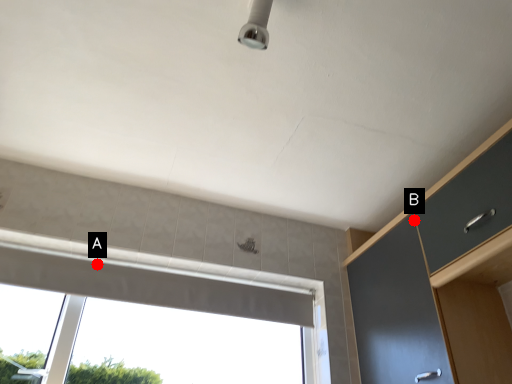
Question: Two points are circled on the image, labeled by A and B beside each circle. Which point is further to the camera?

Choices:
 (A) A is further
 (B) B is further

Answer: (A)